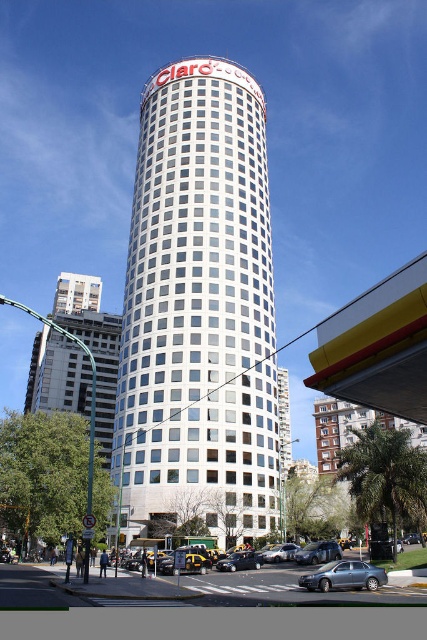
Looking at this image, is gray metallic sedan at lower center smaller than shiny silver sedan at center?

No, gray metallic sedan at lower center is not smaller than shiny silver sedan at center.

Does gray metallic sedan at lower center appear over shiny silver sedan at center?

Indeed, gray metallic sedan at lower center is positioned over shiny silver sedan at center.

Who is more distant from viewer, [386,580] or [257,557]?

The point [257,557] is behind.

Where is `gray metallic sedan at lower center`? gray metallic sedan at lower center is located at coordinates click(x=345, y=577).

Which is behind, point (307, 556) or point (286, 547)?

The point (286, 547) is more distant.

Where is `metallic silver sedan at center`? The height and width of the screenshot is (640, 427). metallic silver sedan at center is located at coordinates (318, 552).

Consider the image. Who is more forward, (382, 572) or (172, 570)?

Positioned in front is point (382, 572).

Does gray metallic sedan at lower center come in front of yellow rubber taxi at lower center?

Yes, it is in front of yellow rubber taxi at lower center.

Is point (366, 564) more distant than point (183, 570)?

No, it is not.

The height and width of the screenshot is (640, 427). Identify the location of gray metallic sedan at lower center. (345, 577).